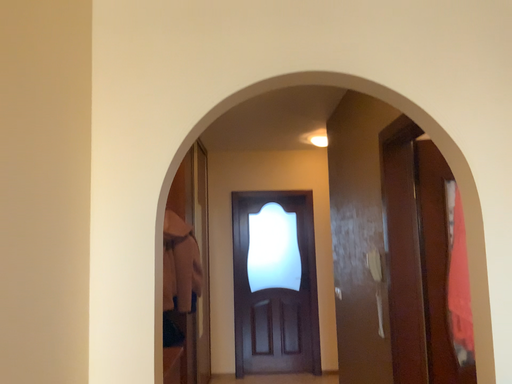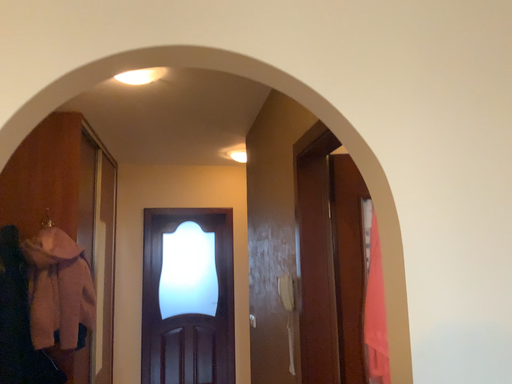
Question: How did the camera likely rotate when shooting the video?

Choices:
 (A) rotated right
 (B) rotated left

Answer: (A)